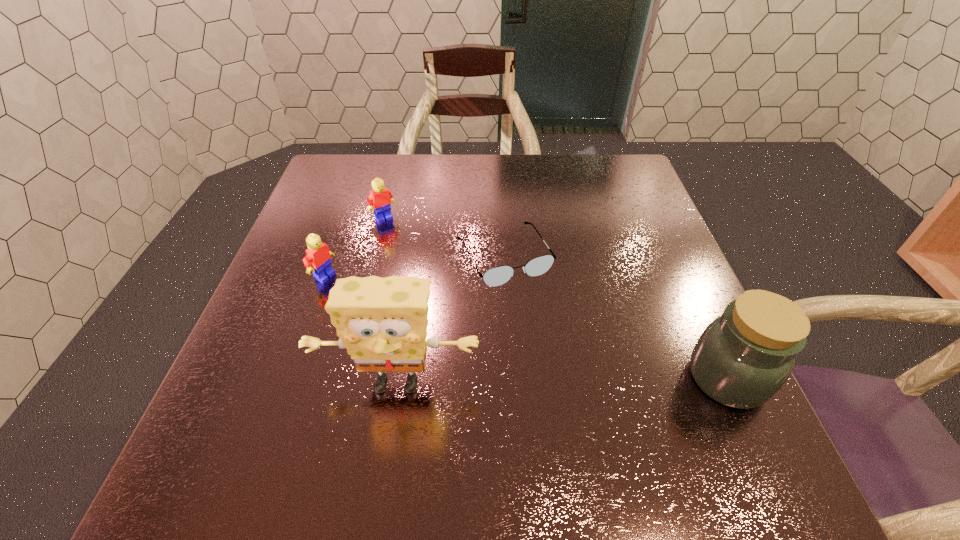
This screenshot has height=540, width=960. Identify the location of free space at the near left corner of the desktop. (276, 431).

Find the location of a particular element. free region at the far right corner of the desktop is located at coordinates pos(624,191).

I want to click on vacant point at the near right corner, so click(x=703, y=416).

Locate an element on the screen. This screenshot has height=540, width=960. free spot between the leftmost object and the shortest object is located at coordinates (414, 266).

At what (x,y) coordinates should I click in order to perform the action: click on free space between the spectacles and the sponge. Please return your answer as a coordinate pair (x, y). The width and height of the screenshot is (960, 540). Looking at the image, I should click on (450, 319).

Identify the location of unoccupied area between the shortest object and the tallest object. Image resolution: width=960 pixels, height=540 pixels. (450, 319).

Find the location of a particular element. The height and width of the screenshot is (540, 960). free space that is in between the shortest object and the nearer Lego is located at coordinates (414, 266).

Where is `vacant point located between the spectacles and the nearer Lego`? vacant point located between the spectacles and the nearer Lego is located at coordinates (414, 266).

Locate an element on the screen. This screenshot has width=960, height=540. free space between the tallest object and the spectacles is located at coordinates (450, 319).

Locate an element on the screen. vacant area that lies between the spectacles and the tallest object is located at coordinates (450, 319).